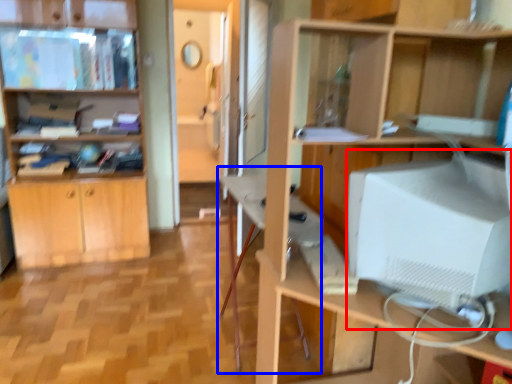
Question: Which object appears farthest to the camera in this image, computer monitor (highlighted by a red box) or computer desk (highlighted by a blue box)?

Choices:
 (A) computer monitor
 (B) computer desk

Answer: (B)